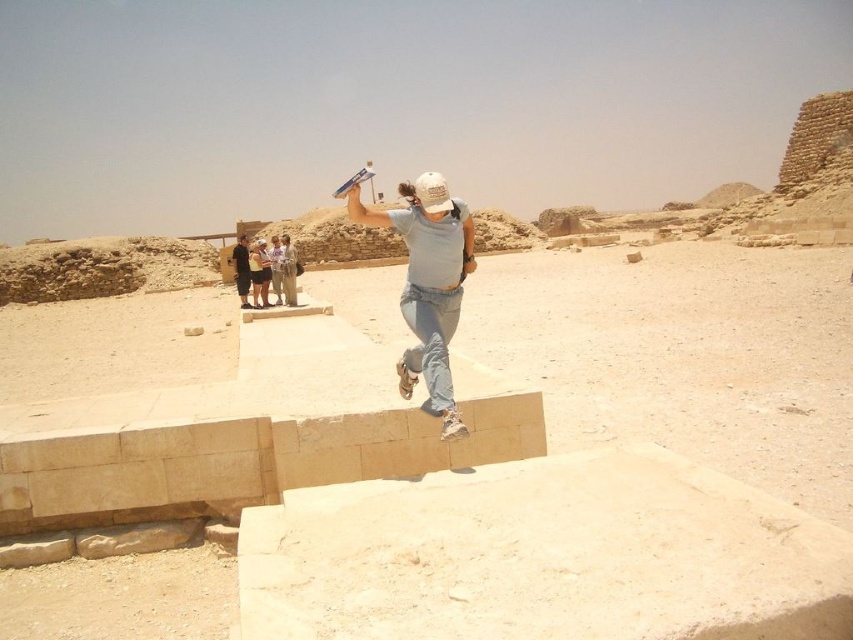
Is point (399, 189) positioned behind point (267, 289)?

That is False.

Between light blue denim jeans at center and light brown fabric shirt at center, which one has more height?

light blue denim jeans at center

Which is in front, point (433, 180) or point (293, 269)?

Positioned in front is point (433, 180).

Locate an element on the screen. light blue denim jeans at center is located at coordinates (428, 284).